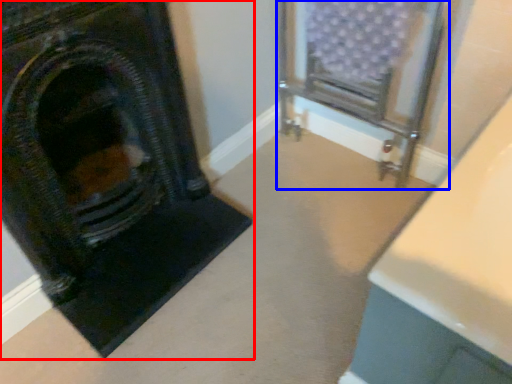
Question: Among these objects, which one is farthest to the camera, fireplace (highlighted by a red box) or furniture (highlighted by a blue box)?

Choices:
 (A) fireplace
 (B) furniture

Answer: (B)